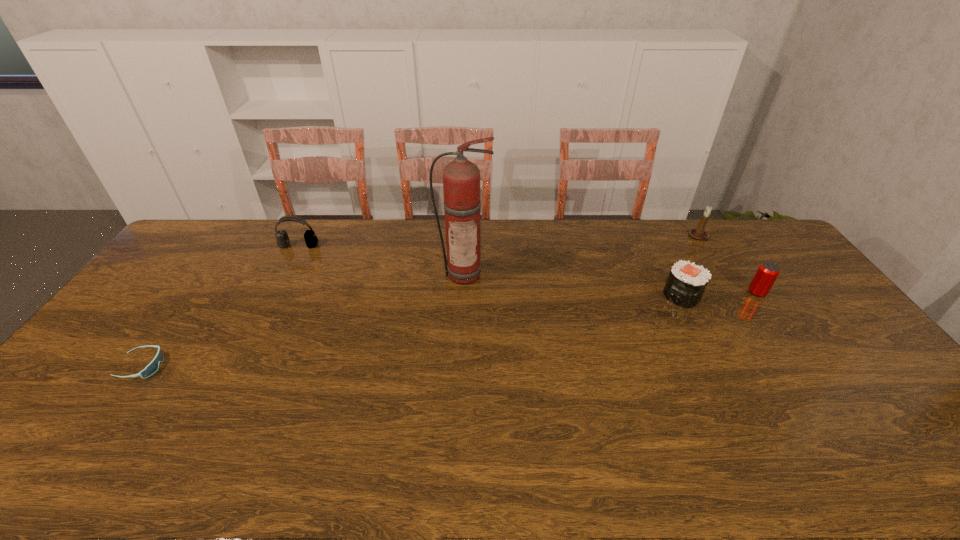
This screenshot has width=960, height=540. In the image, there is a desktop. Find the location of `vacant space at the right edge`. vacant space at the right edge is located at coordinates (904, 420).

The height and width of the screenshot is (540, 960). I want to click on vacant point located between the goggles and the third object from right to left, so click(x=412, y=331).

At what (x,y) coordinates should I click in order to perform the action: click on vacant area between the fourth object from right to left and the rightmost object. Please return your answer as a coordinate pair (x, y). This screenshot has height=540, width=960. Looking at the image, I should click on (611, 283).

Locate an element on the screen. The image size is (960, 540). free space between the can and the fourth object from right to left is located at coordinates click(x=611, y=283).

This screenshot has width=960, height=540. I want to click on vacant space that is in between the headset and the tallest object, so click(381, 259).

Find the location of a particular element. The height and width of the screenshot is (540, 960). unoccupied position between the sushi and the fifth object from right to left is located at coordinates (491, 271).

Identify the location of vacant space that is in between the candle holder and the fourth object from right to left. (582, 255).

Find the location of a particular element. vacant space that is in between the candle holder and the fourth object from right to left is located at coordinates (582, 255).

The width and height of the screenshot is (960, 540). What are the coordinates of `empty space that is in between the fire extinguisher and the rightmost object` in the screenshot? It's located at (611, 283).

At what (x,y) coordinates should I click in order to perform the action: click on free space between the can and the tallest object. Please return your answer as a coordinate pair (x, y). This screenshot has height=540, width=960. Looking at the image, I should click on [611, 283].